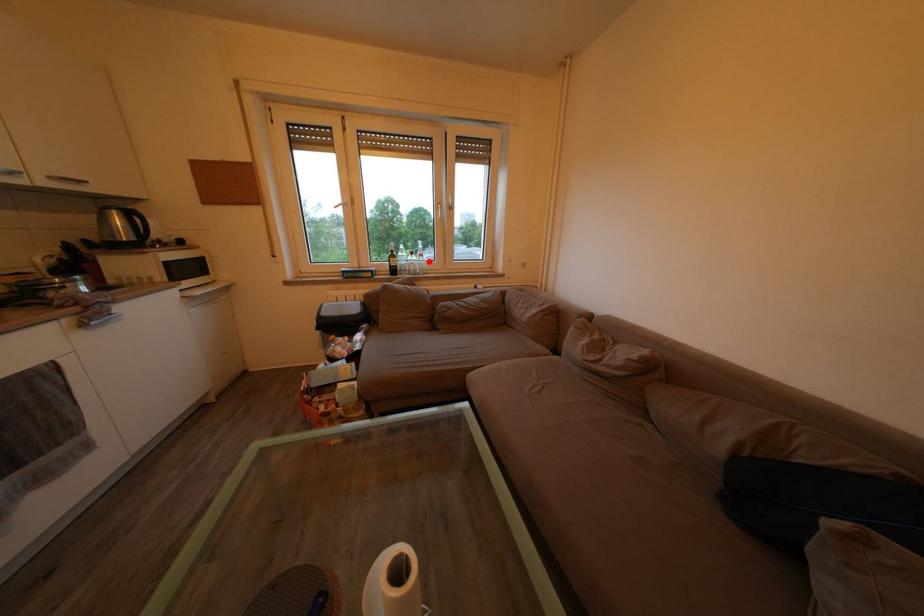
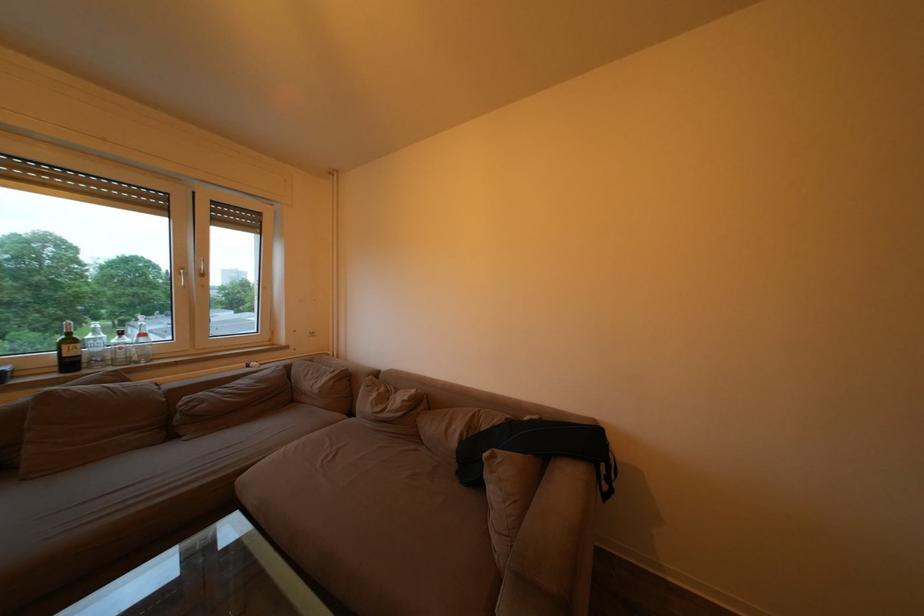
Where in the second image is the point corresponding to the highlighted location from the first image?

(151, 341)